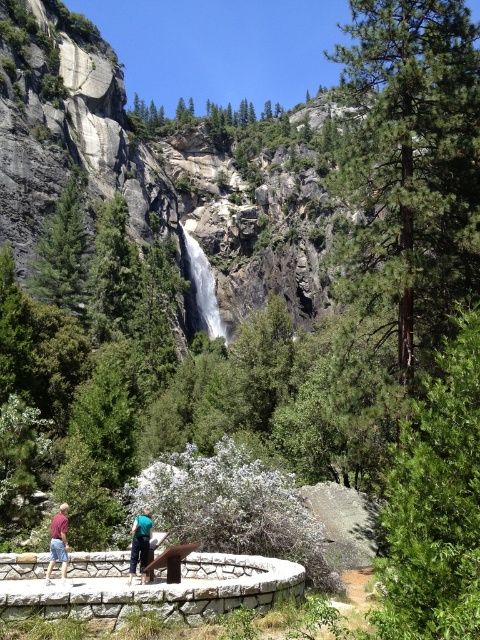
You are planning to take a photo of the white smooth waterfall at center and the maroon fabric shirt at lower left. Since the waterfall is wider, where should you position your camera to ensure both are fully visible in the frame?

The white smooth waterfall at center is wider than the maroon fabric shirt at lower left, so you should position the camera closer to the waterfall to capture its full width while still including the maroon fabric shirt at lower left in the shot.

You are a photographer planning to take a picture of the white smooth waterfall at center and the green fabric shirt at center. Since both are in the scene, can you capture both in a single frame without moving the camera?

The white smooth waterfall at center is positioned over the green fabric shirt at center, so they are layered in the same area. This means the photographer can capture both in a single frame without moving the camera as they are overlapping in the central part of the image.

You are a photographer trying to capture a group photo of the green fabric shirt at center and the maroon fabric shirt at lower left. Since you want to ensure both shirts are clearly visible in the photo, which shirt should you focus on to avoid blurriness due to their size differences?

You should focus on the green fabric shirt at center because it has a smaller width than the maroon fabric shirt at lower left, making it easier to keep in focus given its size.